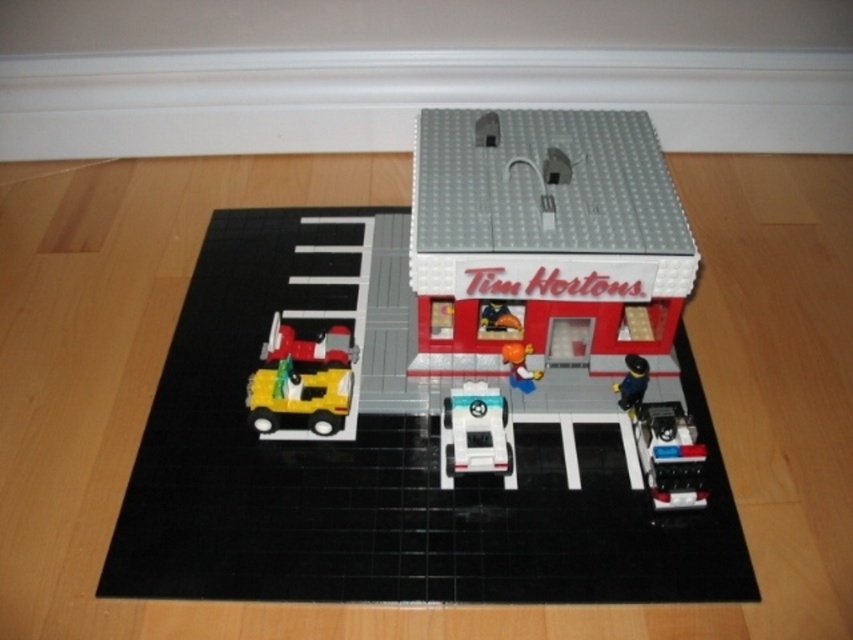
You are a delivery person trying to park your 1.2 meter wide delivery van next to the shiny red car at center and the orange matte figure at center. Based on the scene, can your van fit between them without overlapping?

The shiny red car at center is wider than the orange matte figure at center. Since the van is 1.2 meters wide, it depends on the combined space between them. However, since the car is wider, there might not be enough space. Without exact measurements, it is uncertain.

You are standing at the entrance of the Tim Hortons LEGO model and notice a shiny silver car at lower right and an orange matte figure at center. Which object is positioned further to the right side of the scene?

The shiny silver car at lower right is positioned further to the right side of the scene compared to the orange matte figure at center.